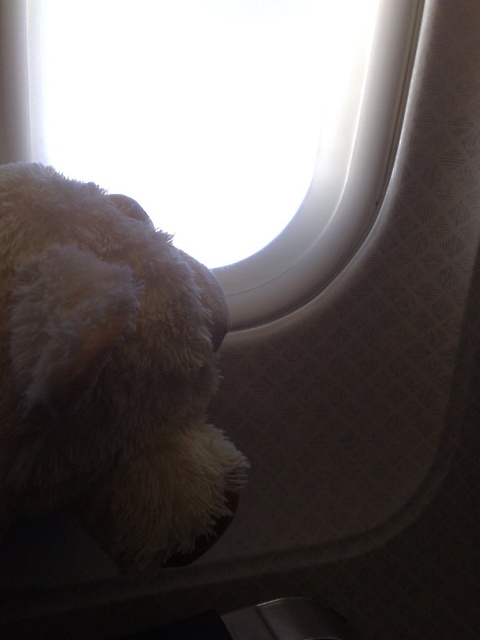
You are sitting in an airplane seat and see the white fluffy stuffed animal at left and the white fluffy teddy bear at lower left. Which one is closer to the airplane window?

The white fluffy teddy bear at lower left is closer to the airplane window because it is positioned to the right of the white fluffy stuffed animal at left, which is further away from the window.